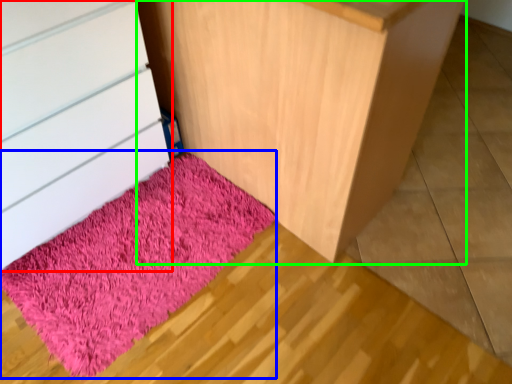
Question: Considering the real-world distances, which object is farthest from chest of drawers (highlighted by a red box)? mat (highlighted by a blue box) or furniture (highlighted by a green box)?

Choices:
 (A) mat
 (B) furniture

Answer: (B)